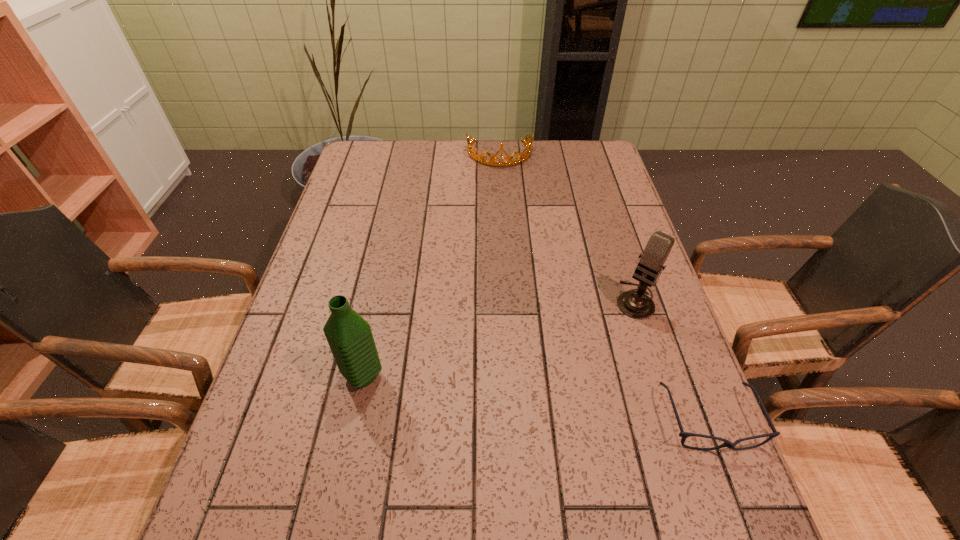
This screenshot has width=960, height=540. I want to click on free space at the right edge, so click(645, 349).

In the image, there is a desktop. Where is `vacant space at the far left corner`? vacant space at the far left corner is located at coordinates (390, 141).

In the image, there is a desktop. In order to click on vacant region at the far right corner in this screenshot , I will do point(562,150).

Image resolution: width=960 pixels, height=540 pixels. In order to click on vacant space at the near right corner of the desktop in this screenshot , I will do `click(660, 457)`.

The width and height of the screenshot is (960, 540). I want to click on vacant space in between the microphone and the leftmost object, so click(x=499, y=338).

You are a GUI agent. You are given a task and a screenshot of the screen. Output one action in this format:
    pyautogui.click(x=<x>, y=<y>)
    Task: Click on the free spot between the microphone and the third tallest object
    
    Given the screenshot: What is the action you would take?
    pyautogui.click(x=567, y=227)

Find the location of `free space between the tiara and the microphone`. free space between the tiara and the microphone is located at coordinates (567, 227).

Identify the location of free space between the microphone and the shortest object. (672, 360).

Where is `vacant space that is in between the spectacles and the tiara`? vacant space that is in between the spectacles and the tiara is located at coordinates (605, 287).

This screenshot has width=960, height=540. What are the coordinates of `blank region between the second shortest object and the second farthest object` in the screenshot? It's located at (567, 227).